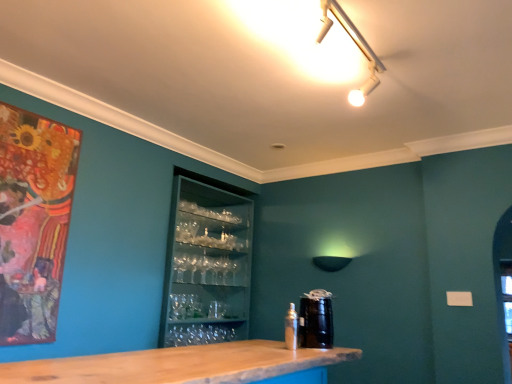
Question: Can you confirm if metallic silver spray can at lower center is wider than matte black lampshade at center?

Choices:
 (A) no
 (B) yes

Answer: (A)

Question: Is metallic silver spray can at lower center further to camera compared to matte black lampshade at center?

Choices:
 (A) no
 (B) yes

Answer: (A)

Question: Is metallic silver spray can at lower center oriented towards matte black lampshade at center?

Choices:
 (A) no
 (B) yes

Answer: (A)

Question: Would you say matte black lampshade at center is part of metallic silver spray can at lower center's contents?

Choices:
 (A) no
 (B) yes

Answer: (A)

Question: Are metallic silver spray can at lower center and matte black lampshade at center beside each other?

Choices:
 (A) no
 (B) yes

Answer: (A)

Question: Considering the relative sizes of metallic silver spray can at lower center and matte black lampshade at center in the image provided, is metallic silver spray can at lower center smaller than matte black lampshade at center?

Choices:
 (A) yes
 (B) no

Answer: (A)

Question: Is transparent glassware at center smaller than black glossy canister at center?

Choices:
 (A) yes
 (B) no

Answer: (B)

Question: Is transparent glassware at center touching black glossy canister at center?

Choices:
 (A) no
 (B) yes

Answer: (A)

Question: Is black glossy canister at center surrounded by transparent glassware at center?

Choices:
 (A) no
 (B) yes

Answer: (A)

Question: From the image's perspective, is transparent glassware at center above black glossy canister at center?

Choices:
 (A) no
 (B) yes

Answer: (A)

Question: From the image's perspective, would you say transparent glassware at center is shown under black glossy canister at center?

Choices:
 (A) no
 (B) yes

Answer: (B)

Question: Does transparent glassware at center have a lesser width compared to black glossy canister at center?

Choices:
 (A) yes
 (B) no

Answer: (B)

Question: Does matte black lampshade at center come in front of metallic silver spray can at lower center?

Choices:
 (A) yes
 (B) no

Answer: (B)